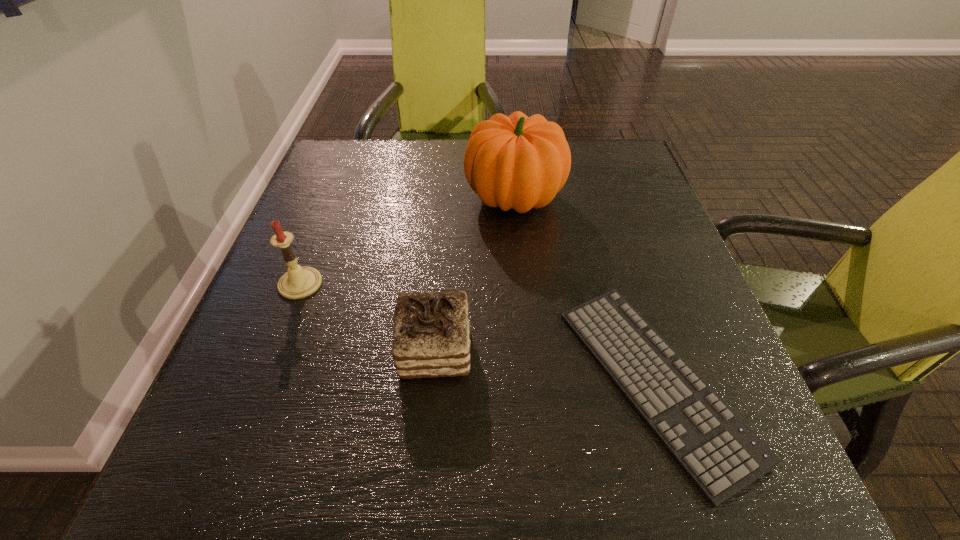
Where is `the farthest object`? the farthest object is located at coordinates (519, 162).

Locate an element on the screen. the tallest object is located at coordinates click(519, 162).

The width and height of the screenshot is (960, 540). I want to click on candle, so click(298, 282).

Image resolution: width=960 pixels, height=540 pixels. I want to click on the third shortest object, so click(x=298, y=282).

Image resolution: width=960 pixels, height=540 pixels. Identify the location of the third tallest object. (431, 338).

At what (x,y) coordinates should I click in order to perform the action: click on computer keyboard. Please return your answer as a coordinate pair (x, y). The height and width of the screenshot is (540, 960). Looking at the image, I should click on (722, 455).

Find the location of a particular element. free space located 0.130m on the left of the pumpkin is located at coordinates (409, 198).

What are the coordinates of `vacant region located 0.060m on the back of the leftmost object` in the screenshot? It's located at 314,248.

At what (x,y) coordinates should I click in order to perform the action: click on free space located 0.340m on the right of the chocolate cake. Please return your answer as a coordinate pair (x, y). This screenshot has width=960, height=540. Looking at the image, I should click on (676, 350).

Where is `vacant space located on the back of the computer keyboard`? vacant space located on the back of the computer keyboard is located at coordinates (602, 212).